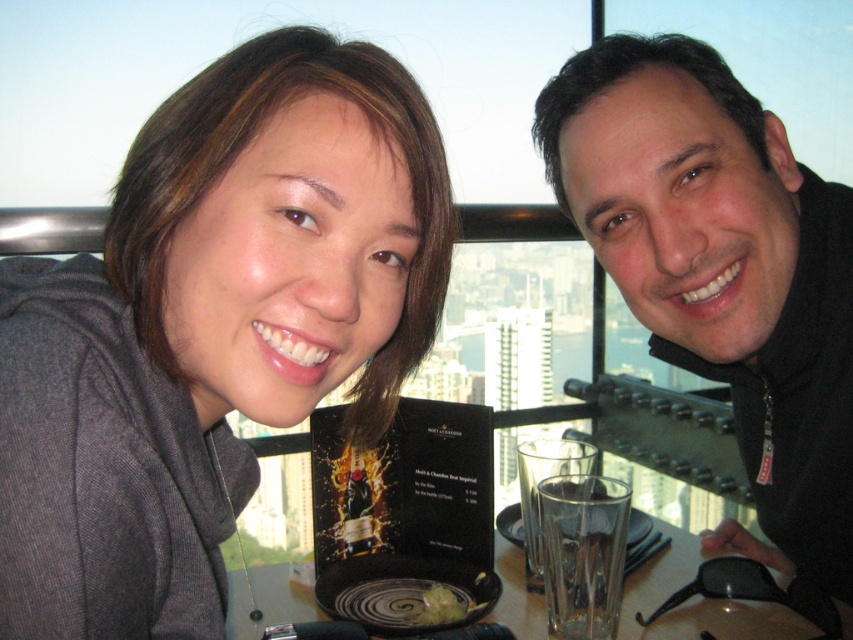
Question: Does matte gray hoodie at left appear on the right side of black matte jacket at upper right?

Choices:
 (A) yes
 (B) no

Answer: (B)

Question: Which point is closer to the camera?

Choices:
 (A) tap(329, 154)
 (B) tap(596, 230)

Answer: (A)

Question: Which of the following is the closest to the observer?

Choices:
 (A) (157, 144)
 (B) (692, 42)

Answer: (A)

Question: Which object is the closest to the matte gray hoodie at left?

Choices:
 (A) black matte jacket at upper right
 (B) translucent glass at center

Answer: (B)

Question: Does matte gray hoodie at left lie in front of translucent glass at center?

Choices:
 (A) yes
 (B) no

Answer: (A)

Question: Can you confirm if matte gray hoodie at left is smaller than translucent glass at center?

Choices:
 (A) yes
 (B) no

Answer: (B)